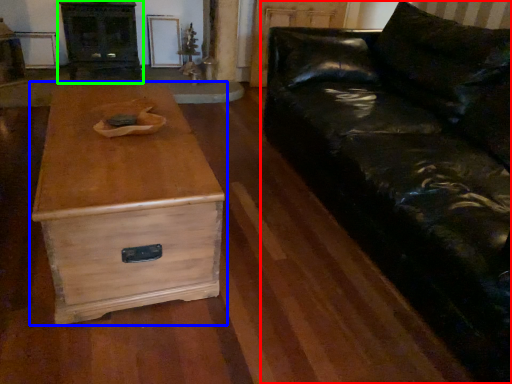
Question: Which object is positioned closest to studio couch (highlighted by a red box)? Select from chest of drawers (highlighted by a blue box) and entertainment center (highlighted by a green box).

Choices:
 (A) chest of drawers
 (B) entertainment center

Answer: (A)